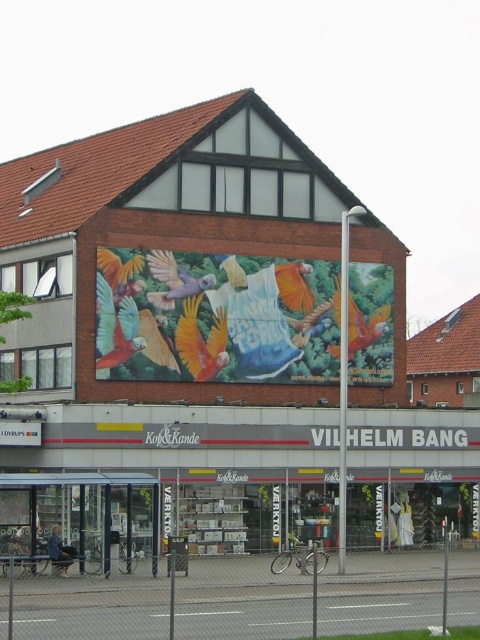
Does vibrant painted mural at center appear on the left side of transparent glass bus stop at lower left?

In fact, vibrant painted mural at center is to the right of transparent glass bus stop at lower left.

Is vibrant painted mural at center above transparent glass bus stop at lower left?

Correct, vibrant painted mural at center is located above transparent glass bus stop at lower left.

Is point (282, 346) farther from camera compared to point (50, 480)?

Yes, it is behind point (50, 480).

The height and width of the screenshot is (640, 480). In order to click on vibrant painted mural at center in this screenshot , I will do click(216, 317).